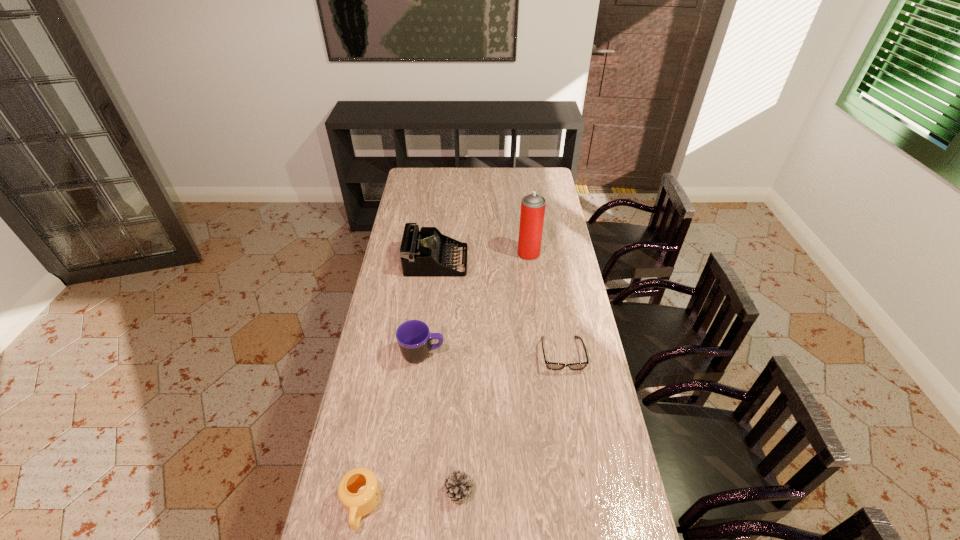
Image resolution: width=960 pixels, height=540 pixels. I want to click on vacant space located 0.380m with the handle on the side of the third tallest object, so click(x=547, y=354).

Find the location of a particular element. The height and width of the screenshot is (540, 960). free space located 0.220m on the back of the fifth tallest object is located at coordinates (462, 410).

Find the location of a particular element. The image size is (960, 540). free region located 0.320m on the lenses of the shortest object is located at coordinates (580, 463).

At what (x,y) coordinates should I click in order to perform the action: click on typewriter that is at the left edge. Please return your answer as a coordinate pair (x, y). Image resolution: width=960 pixels, height=540 pixels. Looking at the image, I should click on (423, 254).

Locate an element on the screen. Image resolution: width=960 pixels, height=540 pixels. aerosol can that is at the right edge is located at coordinates (532, 212).

Find the location of a particular element. Image resolution: width=960 pixels, height=540 pixels. spectacles that is at the right edge is located at coordinates (550, 365).

What are the coordinates of `blank space at the far edge` in the screenshot? It's located at (470, 187).

Find the location of `blank space at the left edge of the desktop`. blank space at the left edge of the desktop is located at coordinates (396, 235).

Image resolution: width=960 pixels, height=540 pixels. In the image, there is a desktop. What are the coordinates of `vacant area at the right edge` in the screenshot? It's located at (564, 239).

Identify the location of vacant area at the far right corner. click(537, 170).